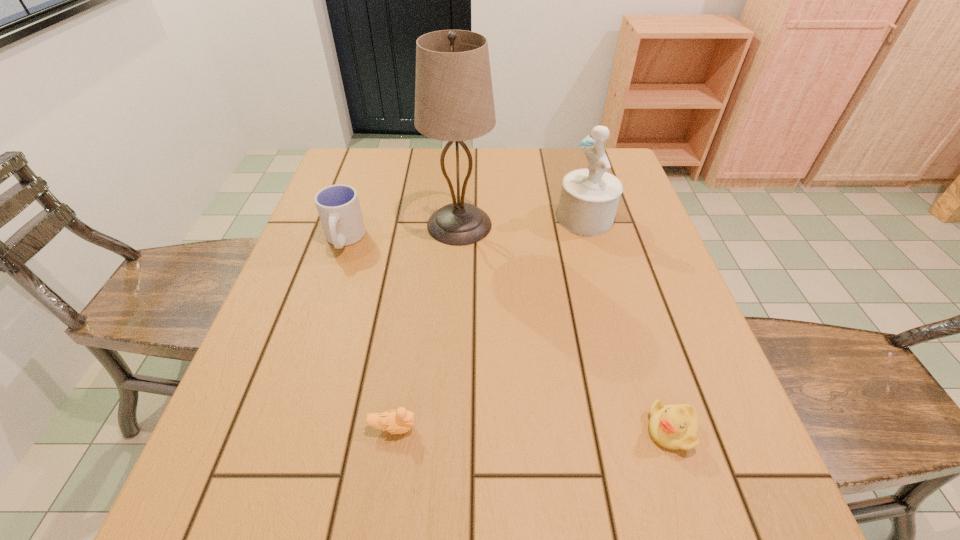
Locate an element on the screen. The width and height of the screenshot is (960, 540). vacant area at the left edge of the desktop is located at coordinates (367, 208).

At what (x,y) coordinates should I click in order to perform the action: click on free space at the right edge of the desktop. Please return your answer as a coordinate pair (x, y). Looking at the image, I should click on point(639,225).

What are the coordinates of `vacant space at the far left corner` in the screenshot? It's located at tap(389, 166).

Locate an element on the screen. free spot between the figurine and the lampshade is located at coordinates (522, 221).

Locate an element on the screen. The image size is (960, 540). vacant space that's between the left duckling and the tallest object is located at coordinates (426, 326).

Locate an element on the screen. vacant area that lies between the third tallest object and the left duckling is located at coordinates click(369, 334).

I want to click on unoccupied area between the left duckling and the lampshade, so click(x=426, y=326).

I want to click on blank region between the leftmost object and the right duckling, so click(x=508, y=335).

At what (x,y) coordinates should I click in order to perform the action: click on free area in between the leftmost object and the left duckling. Please return your answer as a coordinate pair (x, y). The width and height of the screenshot is (960, 540). Looking at the image, I should click on (369, 334).

Find the location of a particular element. The width and height of the screenshot is (960, 540). free area in between the cup and the left duckling is located at coordinates (369, 334).